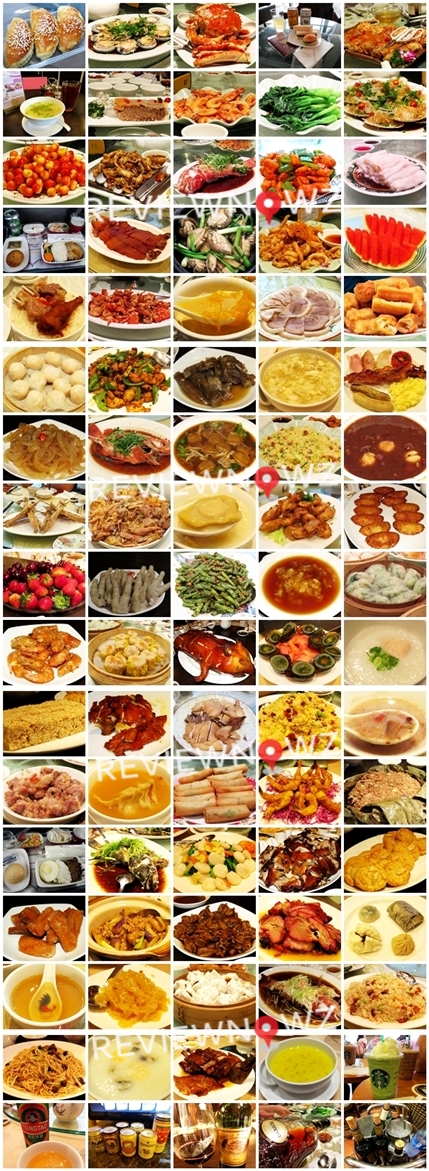
Find the location of a particular element. The image size is (429, 1171). steamer baskets is located at coordinates (197, 1011), (99, 673), (368, 608), (9, 404).